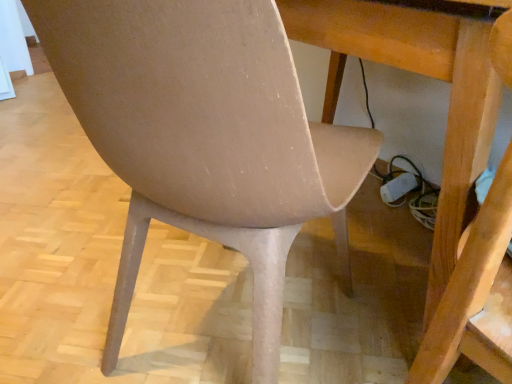
Question: From the image's perspective, is matte beige swivel chair at lower left located above or below wooden table at center?

Choices:
 (A) above
 (B) below

Answer: (B)

Question: From their relative heights in the image, would you say matte beige swivel chair at lower left is taller or shorter than wooden table at center?

Choices:
 (A) short
 (B) tall

Answer: (B)

Question: Considering the real-world distances, which object is closest to the wooden table at center?

Choices:
 (A) matte beige chair at center
 (B) matte beige swivel chair at lower left

Answer: (B)

Question: Which of these objects is positioned farthest from the matte beige chair at center?

Choices:
 (A) matte beige swivel chair at lower left
 (B) wooden table at center

Answer: (A)